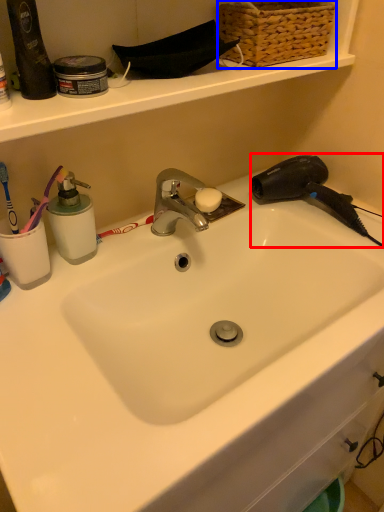
Question: Among these objects, which one is farthest to the camera, hair drier (highlighted by a red box) or basket (highlighted by a blue box)?

Choices:
 (A) hair drier
 (B) basket

Answer: (A)